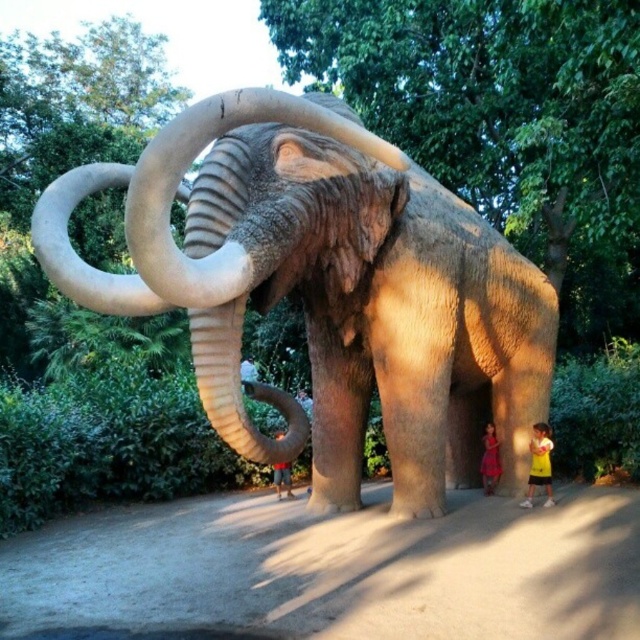
You are standing in front of the woolly mammoth sculpture and notice two points marked on its surface. The first point is at coordinates point (x=541, y=456) and the second is at point (x=273, y=470). Which of these two points is nearer to you?

Point (x=541, y=456) is closer to the viewer than point (x=273, y=470).

You are a photographer trying to capture a photo of the smooth gray elephant at center and the light blue jeans at center. Since you want to ensure both are in focus, you need to know their heights. Which object is taller?

The smooth gray elephant at center is much taller than the light blue jeans at center.

You are an artist planning to paint the woolly mammoth sculpture in the park. You have a yellow cotton shirt at lower right and light blue jeans at center as reference for color. Which clothing item has a smaller width?

The yellow cotton shirt at lower right has a smaller width than the light blue jeans at center according to the description.